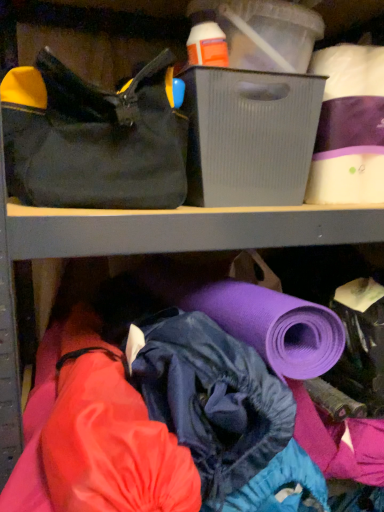
Locate an element on the screen. The height and width of the screenshot is (512, 384). black canvas handbag at upper left is located at coordinates [98, 142].

Identify the location of white matte toilet paper at upper right. [349, 127].

In order to click on gray ribbed plastic storage box at upper center in this screenshot , I will do click(x=249, y=136).

Looking at their sizes, would you say gray ribbed plastic storage box at upper center is wider or thinner than black canvas handbag at upper left?

→ Clearly, gray ribbed plastic storage box at upper center has less width compared to black canvas handbag at upper left.

Is gray ribbed plastic storage box at upper center oriented away from black canvas handbag at upper left?

That's not correct — gray ribbed plastic storage box at upper center is not looking away from black canvas handbag at upper left.

Based on the photo, is gray ribbed plastic storage box at upper center in front of or behind black canvas handbag at upper left in the image?

Clearly, gray ribbed plastic storage box at upper center is behind black canvas handbag at upper left.

Is gray ribbed plastic storage box at upper center next to black canvas handbag at upper left?

No.

Are gray ribbed plastic storage box at upper center and white matte toilet paper at upper right making contact?

No, gray ribbed plastic storage box at upper center is not next to white matte toilet paper at upper right.

Is gray ribbed plastic storage box at upper center facing towards white matte toilet paper at upper right?

No.

Can you confirm if gray ribbed plastic storage box at upper center is taller than white matte toilet paper at upper right?

No.

Considering the sizes of objects gray ribbed plastic storage box at upper center and white matte toilet paper at upper right in the image provided, who is wider, gray ribbed plastic storage box at upper center or white matte toilet paper at upper right?

gray ribbed plastic storage box at upper center is wider.

Is white matte toilet paper at upper right inside or outside of gray ribbed plastic storage box at upper center?

white matte toilet paper at upper right is outside gray ribbed plastic storage box at upper center.

Identify the location of storage box in front of the white matte toilet paper at upper right. This screenshot has width=384, height=512. point(249,136).

Is white matte toilet paper at upper right in contact with gray ribbed plastic storage box at upper center?

No, white matte toilet paper at upper right is not beside gray ribbed plastic storage box at upper center.

From the image's perspective, is white matte toilet paper at upper right located beneath gray ribbed plastic storage box at upper center?

No.

Can you confirm if white matte toilet paper at upper right is smaller than black canvas handbag at upper left?

Correct, white matte toilet paper at upper right occupies less space than black canvas handbag at upper left.

Is white matte toilet paper at upper right positioned far away from black canvas handbag at upper left?

They are positioned close to each other.

From a real-world perspective, is white matte toilet paper at upper right below black canvas handbag at upper left?

No.

Considering the sizes of objects white matte toilet paper at upper right and black canvas handbag at upper left in the image provided, who is wider, white matte toilet paper at upper right or black canvas handbag at upper left?

Wider between the two is black canvas handbag at upper left.

Which is more to the left, black canvas handbag at upper left or white matte toilet paper at upper right?

black canvas handbag at upper left is more to the left.

Can you confirm if black canvas handbag at upper left is smaller than white matte toilet paper at upper right?

Incorrect, black canvas handbag at upper left is not smaller in size than white matte toilet paper at upper right.

Is black canvas handbag at upper left completely or partially outside of gray ribbed plastic storage box at upper center?

black canvas handbag at upper left lies outside gray ribbed plastic storage box at upper center's area.

In the scene shown: How many degrees apart are the facing directions of black canvas handbag at upper left and gray ribbed plastic storage box at upper center?

0.0055 degrees separate the facing orientations of black canvas handbag at upper left and gray ribbed plastic storage box at upper center.

Is black canvas handbag at upper left oriented away from gray ribbed plastic storage box at upper center?

No, black canvas handbag at upper left is not facing away from gray ribbed plastic storage box at upper center.

Locate an element on the screen. This screenshot has width=384, height=512. storage box above the black canvas handbag at upper left (from the image's perspective) is located at coordinates (249, 136).

Identify the location of handbag below the gray ribbed plastic storage box at upper center (from the image's perspective). point(98,142).

Identify the location of storage box in front of the white matte toilet paper at upper right. (249, 136).

Considering their positions, is black canvas handbag at upper left positioned closer to gray ribbed plastic storage box at upper center than white matte toilet paper at upper right?

black canvas handbag at upper left lies closer to gray ribbed plastic storage box at upper center than the other object.

When comparing their distances from white matte toilet paper at upper right, does black canvas handbag at upper left or gray ribbed plastic storage box at upper center seem closer?

Among the two, gray ribbed plastic storage box at upper center is located nearer to white matte toilet paper at upper right.

Which object lies further to the anchor point black canvas handbag at upper left, white matte toilet paper at upper right or gray ribbed plastic storage box at upper center?

white matte toilet paper at upper right is positioned further to the anchor black canvas handbag at upper left.

Which object lies further to the anchor point black canvas handbag at upper left, gray ribbed plastic storage box at upper center or white matte toilet paper at upper right?

Based on the image, white matte toilet paper at upper right appears to be further to black canvas handbag at upper left.

Which object lies further to the anchor point gray ribbed plastic storage box at upper center, white matte toilet paper at upper right or black canvas handbag at upper left?

white matte toilet paper at upper right is positioned further to the anchor gray ribbed plastic storage box at upper center.

When comparing their distances from white matte toilet paper at upper right, does gray ribbed plastic storage box at upper center or black canvas handbag at upper left seem closer?

Based on the image, gray ribbed plastic storage box at upper center appears to be nearer to white matte toilet paper at upper right.

The width and height of the screenshot is (384, 512). Find the location of `storage box between black canvas handbag at upper left and white matte toilet paper at upper right`. storage box between black canvas handbag at upper left and white matte toilet paper at upper right is located at coordinates tap(249, 136).